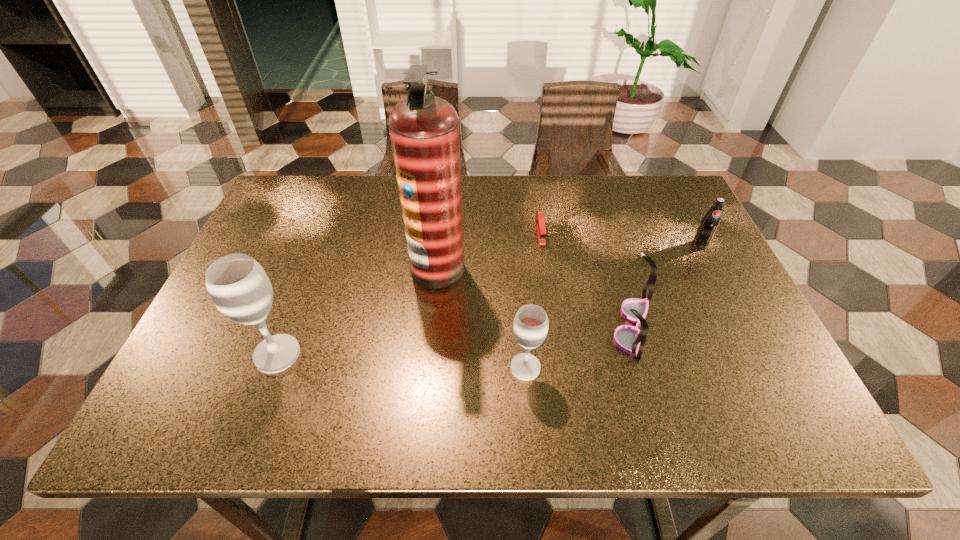
This screenshot has width=960, height=540. Identify the location of vacant spot to place a wineglass on the right. (785, 381).